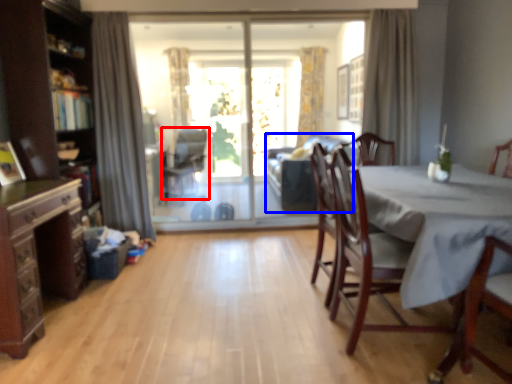
Question: Which point is closer to the camera, chair (highlighted by a red box) or couch (highlighted by a blue box)?

Choices:
 (A) chair
 (B) couch

Answer: (B)